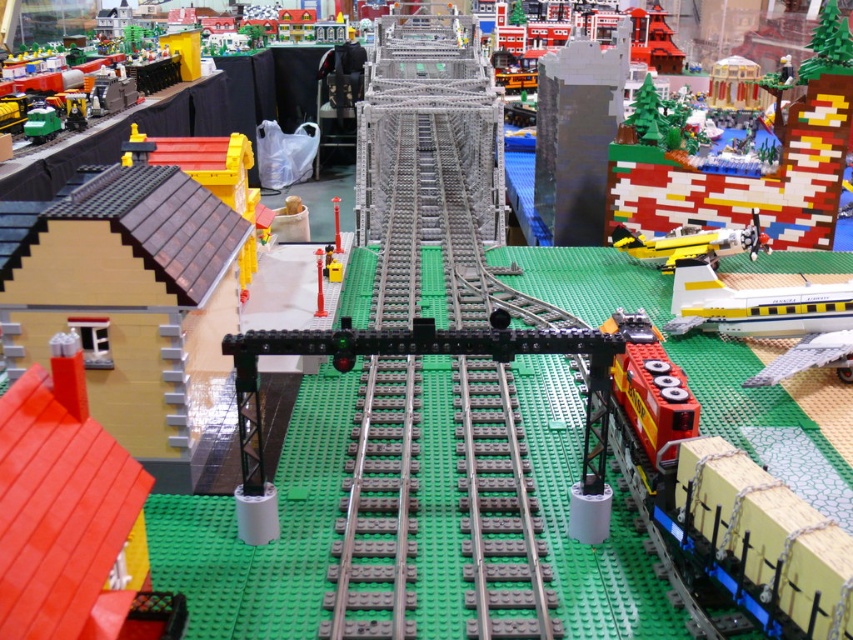
Which is more to the right, brick wall at upper right or yellow matte airplane at lower right?

brick wall at upper right

Can you confirm if brick wall at upper right is smaller than yellow matte airplane at lower right?

No, brick wall at upper right is not smaller than yellow matte airplane at lower right.

Where is `brick wall at upper right`? brick wall at upper right is located at coordinates (746, 160).

This screenshot has width=853, height=640. Find the location of `brick wall at upper right`. brick wall at upper right is located at coordinates (746, 160).

Which of these two, smooth red roof at left or yellow matte airplane at lower right, stands shorter?

Standing shorter between the two is yellow matte airplane at lower right.

This screenshot has height=640, width=853. What do you see at coordinates (71, 516) in the screenshot?
I see `smooth red roof at left` at bounding box center [71, 516].

Identify the location of smooth red roof at left. (71, 516).

Can you confirm if smooth red roof at left is smaller than brick wall at upper right?

Correct, smooth red roof at left occupies less space than brick wall at upper right.

Which is above, smooth red roof at left or brick wall at upper right?

brick wall at upper right

Measure the distance between point [13,529] and camera.

The distance of point [13,529] from camera is 1.01 meters.

Locate an element on the screen. Image resolution: width=853 pixels, height=640 pixels. smooth red roof at left is located at coordinates (71, 516).